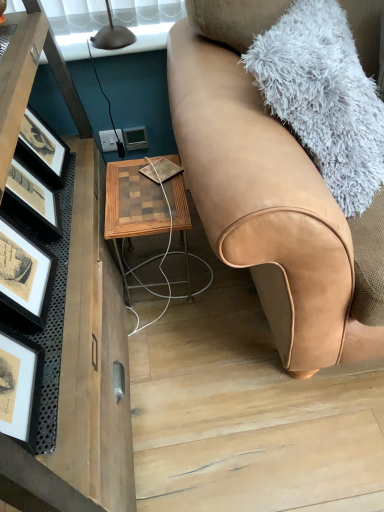
The image size is (384, 512). Describe the element at coordinates (267, 194) in the screenshot. I see `tan leather couch at right` at that location.

Image resolution: width=384 pixels, height=512 pixels. Identify the location of woodenmaterial/texturetable at center. [132, 207].

Looking at this image, from the image's perspective, is woodenmaterial/texturetable at center above or below tan leather couch at right?

Based on their image positions, woodenmaterial/texturetable at center is located beneath tan leather couch at right.

Consider the image. Is woodenmaterial/texturetable at center positioned beyond the bounds of tan leather couch at right?

That's correct, woodenmaterial/texturetable at center is outside of tan leather couch at right.

Is woodenmaterial/texturetable at center shorter than tan leather couch at right?

Yes.

Would you say woodenmaterial/texturetable at center is to the left or to the right of tan leather couch at right in the picture?

In the image, woodenmaterial/texturetable at center appears on the left side of tan leather couch at right.

This screenshot has height=512, width=384. I want to click on table located on the left of tan leather couch at right, so click(132, 207).

Which object is positioned more to the left, tan leather couch at right or woodenmaterial/texturetable at center?

woodenmaterial/texturetable at center is more to the left.

Which of these two, tan leather couch at right or woodenmaterial/texturetable at center, stands taller?

tan leather couch at right is taller.

Is woodenmaterial/texturetable at center facing away from matte gray thermostat at center?

Yes, woodenmaterial/texturetable at center is facing away from matte gray thermostat at center.

The width and height of the screenshot is (384, 512). What are the coordinates of `picture frame above the woodenmaterial/texturetable at center (from a real-world perspective)` in the screenshot? It's located at (135, 138).

From a real-world perspective, which object rests below the other?

From a 3D spatial view, woodenmaterial/texturetable at center is below.

From a real-world perspective, is tan leather couch at right above or below matte gray thermostat at center?

In terms of real-world spatial position, tan leather couch at right is above matte gray thermostat at center.

Considering the sizes of objects tan leather couch at right and matte gray thermostat at center in the image provided, who is shorter, tan leather couch at right or matte gray thermostat at center?

matte gray thermostat at center is shorter.

Is tan leather couch at right placed right next to matte gray thermostat at center?

No, tan leather couch at right is not making contact with matte gray thermostat at center.

Can you confirm if tan leather couch at right is positioned to the left of matte gray thermostat at center?

No, tan leather couch at right is not to the left of matte gray thermostat at center.

Choose the correct answer: Is matte gray thermostat at center inside woodenmaterial/texturetable at center or outside it?

The correct answer is: outside.

Between matte gray thermostat at center and woodenmaterial/texturetable at center, which one appears on the right side from the viewer's perspective?

From the viewer's perspective, woodenmaterial/texturetable at center appears more on the right side.

Locate an element on the screen. The width and height of the screenshot is (384, 512). studio couch located in front of the matte gray thermostat at center is located at coordinates (267, 194).

Is matte gray thermostat at center in front of or behind tan leather couch at right in the image?

Clearly, matte gray thermostat at center is behind tan leather couch at right.

Looking at the image, does matte gray thermostat at center seem bigger or smaller compared to tan leather couch at right?

Considering their sizes, matte gray thermostat at center takes up less space than tan leather couch at right.

Considering the positions of point (141, 129) and point (285, 164), is point (141, 129) closer or farther from the camera than point (285, 164)?

Clearly, point (141, 129) is more distant from the camera than point (285, 164).

The width and height of the screenshot is (384, 512). Identify the location of table behind the tan leather couch at right. (132, 207).

I want to click on table on the left of the tan leather couch at right, so click(x=132, y=207).

Estimate the real-world distances between objects in this image. Which object is closer to tan leather couch at right, woodenmaterial/texturetable at center or matte gray thermostat at center?

Among the two, woodenmaterial/texturetable at center is located nearer to tan leather couch at right.

Which object lies further to the anchor point matte gray thermostat at center, woodenmaterial/texturetable at center or tan leather couch at right?

tan leather couch at right.

Based on their spatial positions, is tan leather couch at right or woodenmaterial/texturetable at center further from matte gray thermostat at center?

Based on the image, tan leather couch at right appears to be further to matte gray thermostat at center.

Consider the image. When comparing their distances from woodenmaterial/texturetable at center, does matte gray thermostat at center or tan leather couch at right seem closer?

Based on the image, tan leather couch at right appears to be nearer to woodenmaterial/texturetable at center.

Based on their spatial positions, is matte gray thermostat at center or woodenmaterial/texturetable at center further from tan leather couch at right?

Based on the image, matte gray thermostat at center appears to be further to tan leather couch at right.

Looking at the image, which one is located closer to woodenmaterial/texturetable at center, tan leather couch at right or matte gray thermostat at center?

tan leather couch at right is closer to woodenmaterial/texturetable at center.

I want to click on table between tan leather couch at right and matte gray thermostat at center from front to back, so click(132, 207).